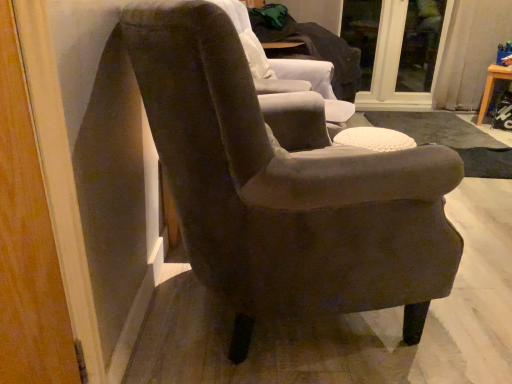
Question: Considering the relative sizes of suede-like brown armchair at center, arranged as the 1th chair when viewed from the front, and transparent glass door at upper center, positioned as the first glass door in left-to-right order, in the image provided, is suede-like brown armchair at center, arranged as the 1th chair when viewed from the front, thinner than transparent glass door at upper center, positioned as the first glass door in left-to-right order,?

Choices:
 (A) no
 (B) yes

Answer: (A)

Question: Would you say suede-like brown armchair at center, marked as the second chair in a back-to-front arrangement, is a long distance from transparent glass door at upper center, positioned as the first glass door in left-to-right order?

Choices:
 (A) no
 (B) yes

Answer: (B)

Question: Does suede-like brown armchair at center, arranged as the 1th chair when viewed from the front, have a greater width compared to transparent glass door at upper center, positioned as the first glass door in left-to-right order?

Choices:
 (A) no
 (B) yes

Answer: (B)

Question: Is suede-like brown armchair at center, arranged as the 1th chair when viewed from the front, oriented away from transparent glass door at upper center, which appears as the second glass door when viewed from the right?

Choices:
 (A) no
 (B) yes

Answer: (A)

Question: Does suede-like brown armchair at center, arranged as the 1th chair when viewed from the front, turn towards transparent glass door at upper center, which appears as the second glass door when viewed from the right?

Choices:
 (A) no
 (B) yes

Answer: (A)

Question: In terms of width, does transparent glass door at upper center, which appears as the second glass door when viewed from the right, look wider or thinner when compared to velvet-like brown armchair at center, placed as the second chair when sorted from front to back?

Choices:
 (A) wide
 (B) thin

Answer: (B)

Question: From the image's perspective, is transparent glass door at upper center, which appears as the second glass door when viewed from the right, located above or below velvet-like brown armchair at center, placed as the second chair when sorted from front to back?

Choices:
 (A) below
 (B) above

Answer: (B)

Question: Considering their positions, is transparent glass door at upper center, which appears as the second glass door when viewed from the right, located in front of or behind velvet-like brown armchair at center, which appears as the 1th chair when viewed from the back?

Choices:
 (A) front
 (B) behind

Answer: (B)

Question: Considering the positions of point (443, 41) and point (328, 69), is point (443, 41) closer or farther from the camera than point (328, 69)?

Choices:
 (A) closer
 (B) farther

Answer: (B)

Question: Would you say transparent glass door at upper right, the 2th glass door from the left, is inside or outside wooden stool at right?

Choices:
 (A) outside
 (B) inside

Answer: (A)

Question: From the image's perspective, is transparent glass door at upper right, the 2th glass door from the left, located above or below wooden stool at right?

Choices:
 (A) above
 (B) below

Answer: (A)

Question: Is transparent glass door at upper right, the 2th glass door from the left, wider or thinner than wooden stool at right?

Choices:
 (A) wide
 (B) thin

Answer: (B)

Question: Is transparent glass door at upper right, the 2th glass door from the left, bigger or smaller than wooden stool at right?

Choices:
 (A) small
 (B) big

Answer: (A)

Question: From a real-world perspective, is wooden stool at right physically located above or below velvet-like brown armchair at center, placed as the second chair when sorted from front to back?

Choices:
 (A) above
 (B) below

Answer: (B)

Question: Is wooden stool at right situated inside velvet-like brown armchair at center, placed as the second chair when sorted from front to back, or outside?

Choices:
 (A) outside
 (B) inside

Answer: (A)